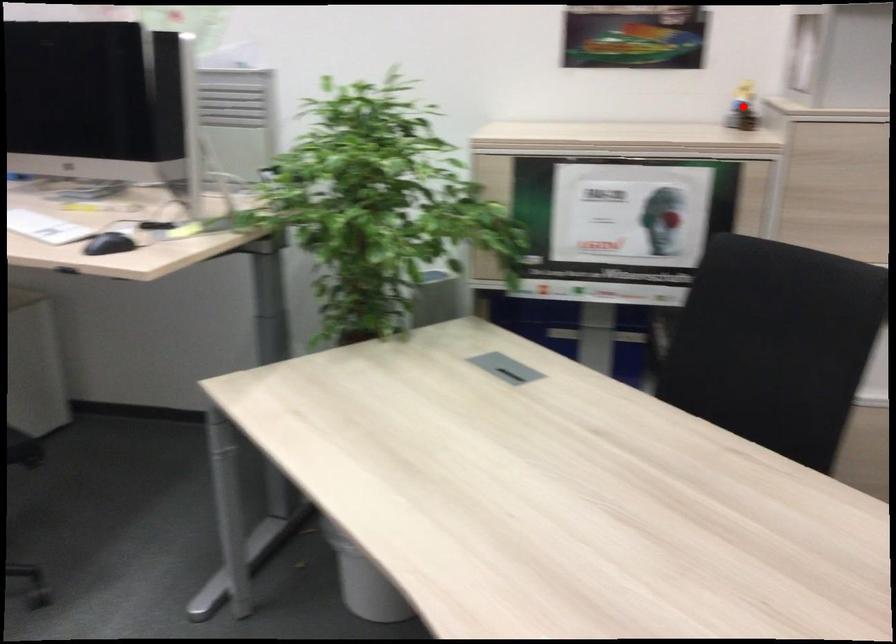
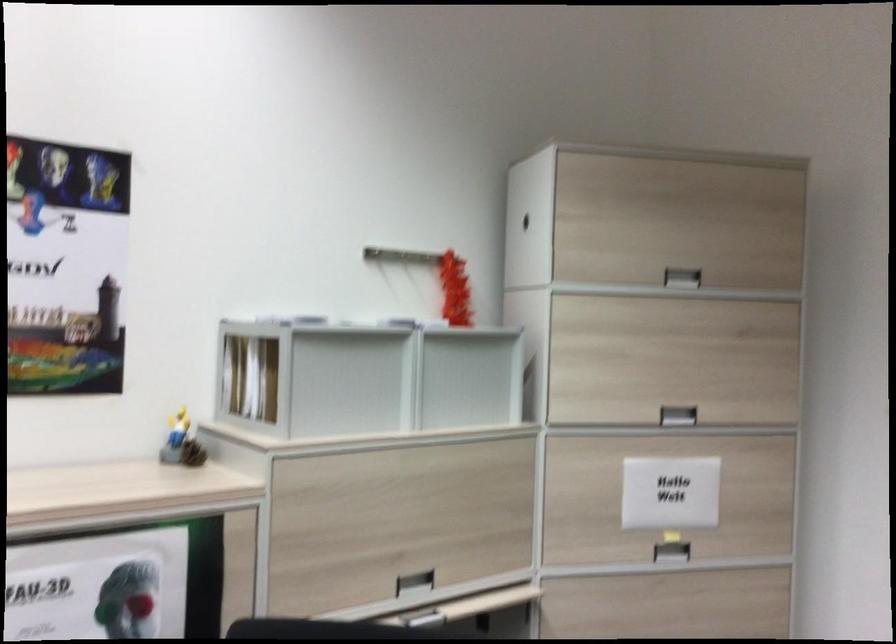
Find the pixel in the second image that matches the highlighted location in the first image.

(181, 442)